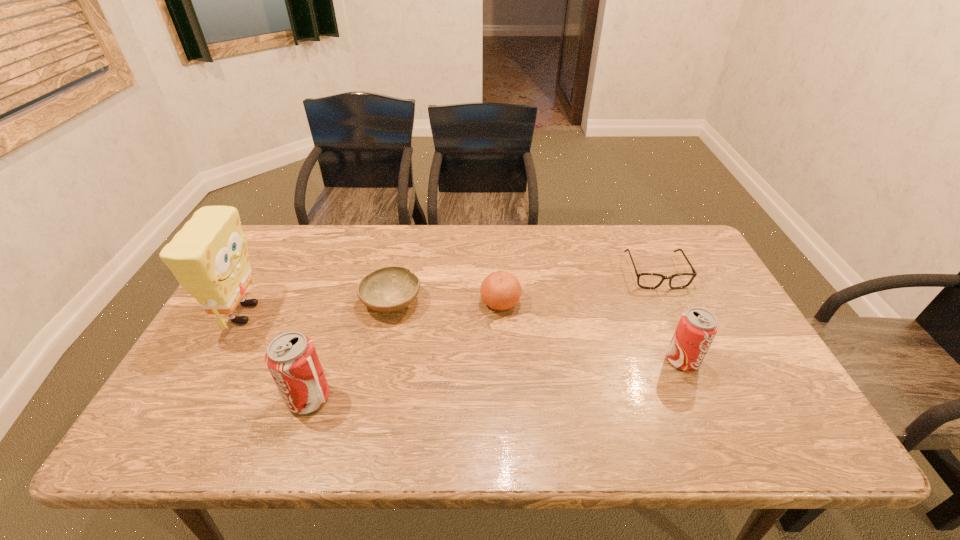
This screenshot has width=960, height=540. I want to click on vacant area situated 0.330m on the right of the left soda can, so click(x=471, y=398).

Locate an element on the screen. vacant area situated on the right of the fifth farthest object is located at coordinates (731, 360).

Identify the location of vacant region located on the front-facing side of the spectacles. (690, 349).

Find the location of a particular element. The image size is (960, 540). vacant space located 0.260m on the face of the tallest object is located at coordinates (359, 314).

Find the location of a particular element. This screenshot has width=960, height=540. free space located 0.110m on the back of the third object from right to left is located at coordinates (498, 266).

Locate an element on the screen. Image resolution: width=960 pixels, height=540 pixels. vacant region located on the back of the bowl is located at coordinates (400, 259).

The height and width of the screenshot is (540, 960). In order to click on object present at the far edge in this screenshot , I will do `click(644, 280)`.

This screenshot has width=960, height=540. In order to click on object that is positioned at the near edge in this screenshot , I will do `click(291, 358)`.

At what (x,y) coordinates should I click in order to perform the action: click on object that is at the left edge. Please return your answer as a coordinate pair (x, y). Looking at the image, I should click on (209, 258).

You are a GUI agent. You are given a task and a screenshot of the screen. Output one action in this format:
    pyautogui.click(x=<x>, y=<y>)
    Task: Click on the object that is at the right edge
    
    Given the screenshot: What is the action you would take?
    pyautogui.click(x=644, y=280)